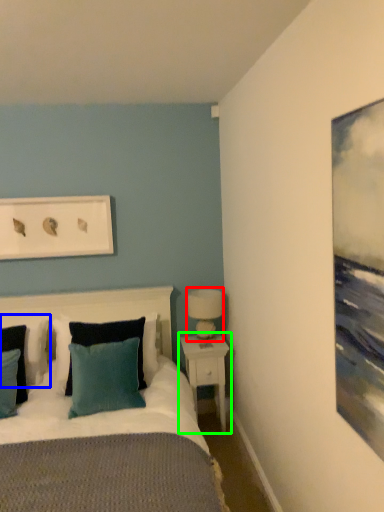
Question: Which object is the farthest from table lamp (highlighted by a red box)? Choose among these: pillow (highlighted by a blue box) or nightstand (highlighted by a green box).

Choices:
 (A) pillow
 (B) nightstand

Answer: (A)